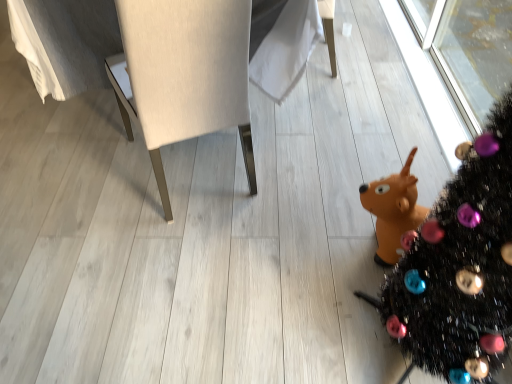
Locate an element on the screen. Image resolution: width=512 pixels, height=384 pixels. vacant space to the left of matte white chair at center is located at coordinates (70, 198).